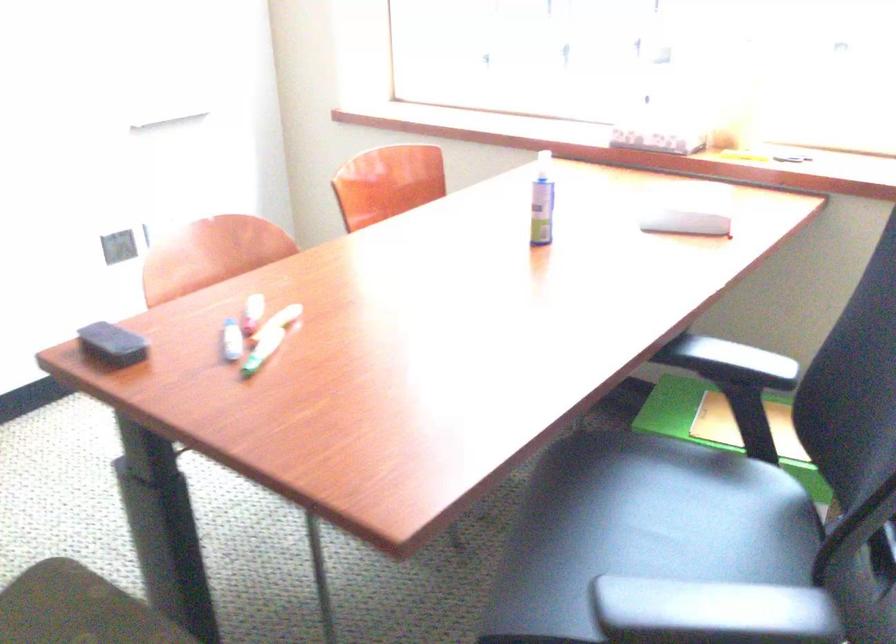
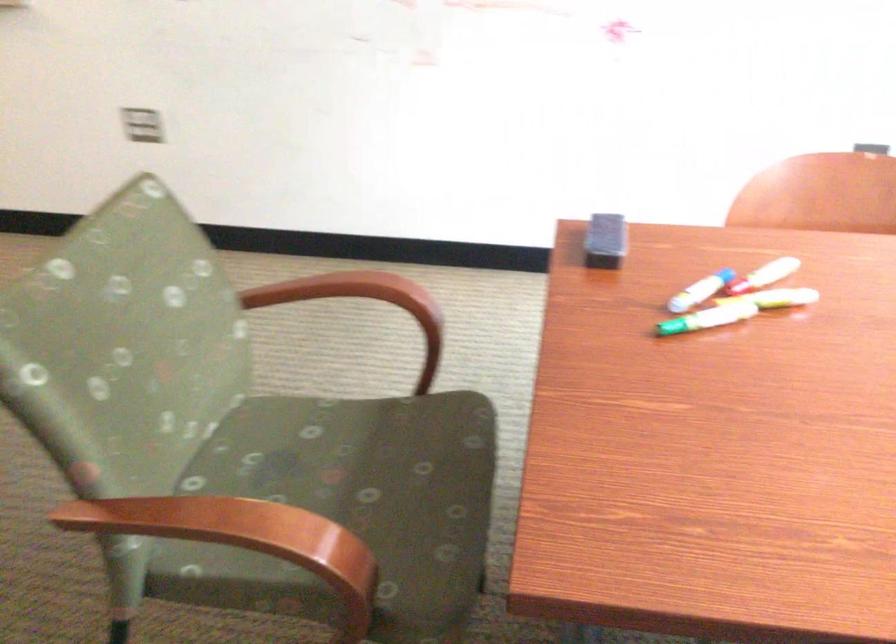
The first image is from the beginning of the video and the second image is from the end. How did the camera likely rotate when shooting the video?

The camera rotated toward left-down.